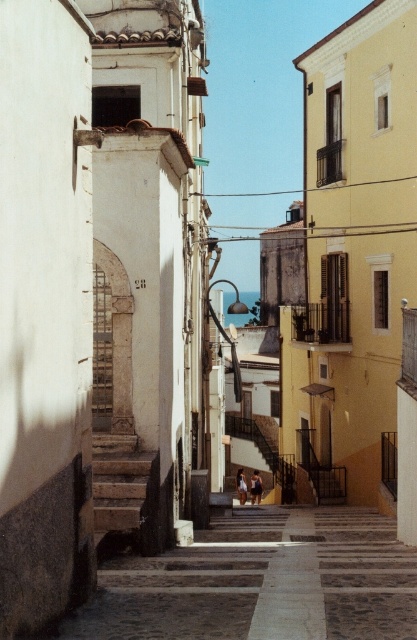
From the picture: Who is more distant from viewer, (251, 477) or (238, 472)?

The point (238, 472) is more distant.

Locate an element on the screen. The width and height of the screenshot is (417, 640). light brown fabric pants at center is located at coordinates (256, 486).

The image size is (417, 640). In order to click on light brown fabric pants at center in this screenshot , I will do click(256, 486).

Measure the distance from stone stairs at lower center to light brown fabric pants at center.

21.87 meters

Can you confirm if stone stairs at lower center is positioned to the left of light brown fabric pants at center?

Correct, you'll find stone stairs at lower center to the left of light brown fabric pants at center.

What do you see at coordinates (125, 490) in the screenshot? This screenshot has width=417, height=640. I see `stone stairs at lower center` at bounding box center [125, 490].

Identify the location of stone stairs at lower center. The width and height of the screenshot is (417, 640). (125, 490).

Does stone stairs at lower center have a larger size compared to tan fabric bikini at center?

No, stone stairs at lower center is not bigger than tan fabric bikini at center.

Does stone stairs at lower center appear on the left side of tan fabric bikini at center?

Indeed, stone stairs at lower center is positioned on the left side of tan fabric bikini at center.

Which is behind, point (153, 522) or point (236, 486)?

Point (236, 486)

Where is `stone stairs at lower center`? The image size is (417, 640). stone stairs at lower center is located at coordinates (125, 490).